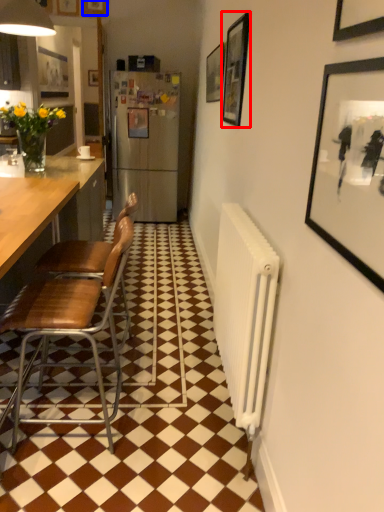
Question: Which of the following is the closest to the observer, picture frame (highlighted by a red box) or picture frame (highlighted by a blue box)?

Choices:
 (A) picture frame
 (B) picture frame

Answer: (A)